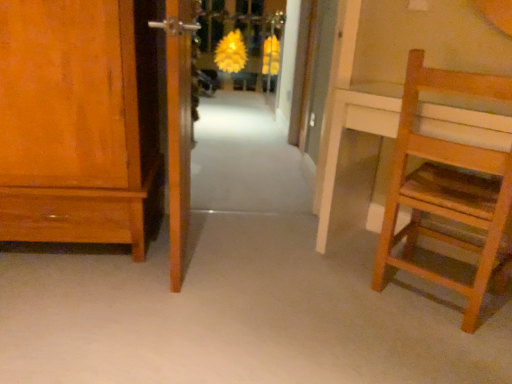
Question: Considering the relative sizes of wooden floor at center and matte wood cabinet at left in the image provided, is wooden floor at center thinner than matte wood cabinet at left?

Choices:
 (A) no
 (B) yes

Answer: (A)

Question: Could you tell me if wooden floor at center is facing matte wood cabinet at left?

Choices:
 (A) yes
 (B) no

Answer: (B)

Question: Is wooden floor at center smaller than matte wood cabinet at left?

Choices:
 (A) no
 (B) yes

Answer: (B)

Question: Does wooden floor at center have a lesser height compared to matte wood cabinet at left?

Choices:
 (A) yes
 (B) no

Answer: (A)

Question: From the image's perspective, is wooden floor at center beneath matte wood cabinet at left?

Choices:
 (A) no
 (B) yes

Answer: (B)

Question: Would you say wooden floor at center contains matte wood cabinet at left?

Choices:
 (A) no
 (B) yes

Answer: (A)

Question: Can wooden floor at center be found inside matte wood cabinet at left?

Choices:
 (A) yes
 (B) no

Answer: (B)

Question: Can you confirm if matte wood cabinet at left is smaller than wooden floor at center?

Choices:
 (A) no
 (B) yes

Answer: (A)

Question: From the image's perspective, would you say matte wood cabinet at left is shown under wooden floor at center?

Choices:
 (A) no
 (B) yes

Answer: (A)

Question: Is matte wood cabinet at left closer to camera compared to wooden floor at center?

Choices:
 (A) no
 (B) yes

Answer: (A)

Question: Considering the relative positions of matte wood cabinet at left and wooden floor at center in the image provided, is matte wood cabinet at left to the left of wooden floor at center from the viewer's perspective?

Choices:
 (A) yes
 (B) no

Answer: (A)

Question: Considering the relative sizes of matte wood cabinet at left and wooden floor at center in the image provided, is matte wood cabinet at left shorter than wooden floor at center?

Choices:
 (A) yes
 (B) no

Answer: (B)

Question: Considering the relative sizes of matte wood cabinet at left and wooden door at center, which ranks as the second door in left-to-right order, in the image provided, is matte wood cabinet at left shorter than wooden door at center, which ranks as the second door in left-to-right order,?

Choices:
 (A) yes
 (B) no

Answer: (A)